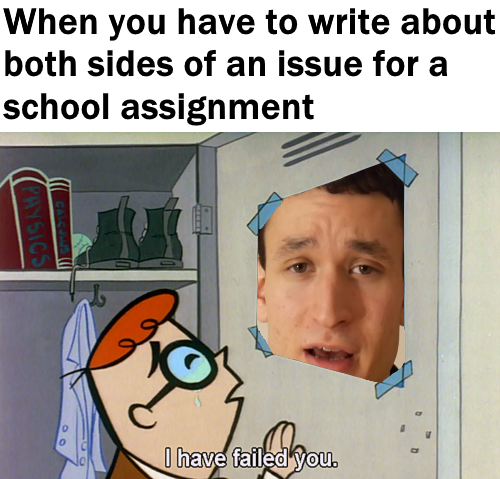
The height and width of the screenshot is (479, 500). I want to click on hinge, so click(x=208, y=216).